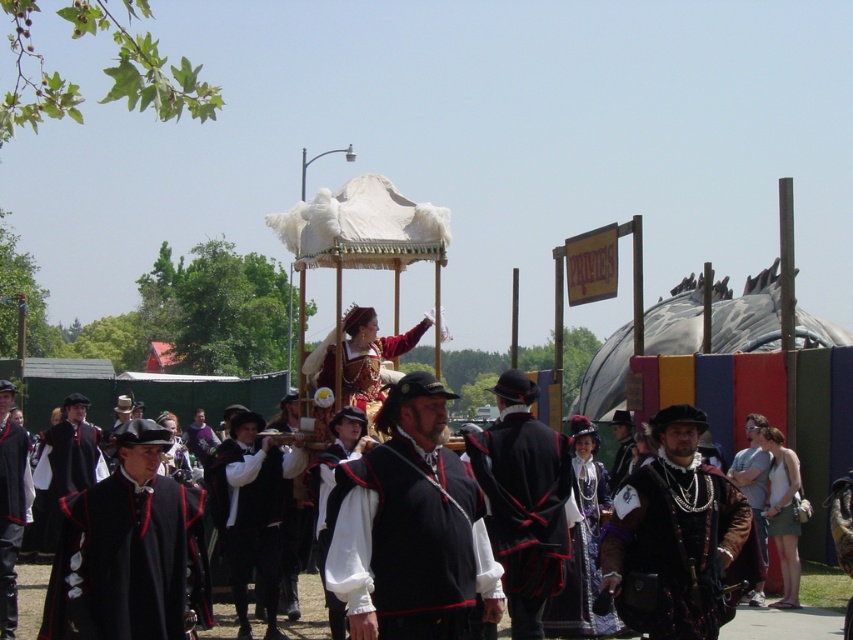
You are a photographer at the Renaissance fair and want to capture both the black velvet cape at center and the gold metallic armor at center in your shot. Which object should you adjust your camera to focus on first if you want to include both in the frame?

The black velvet cape at center is to the left of the gold metallic armor at center, so you should focus on the gold metallic armor at center first to ensure both are in the frame.

You are a costume designer observing the Renaissance fair procession. You need to determine which cape can better accommodate a larger emblem on the back without looking overcrowded. Based on the velvet brown cape at center and the matte black cape at left, which one would you recommend?

The velvet brown cape at center has a larger size compared to the matte black cape at left, making it more suitable for a larger emblem without overcrowding.